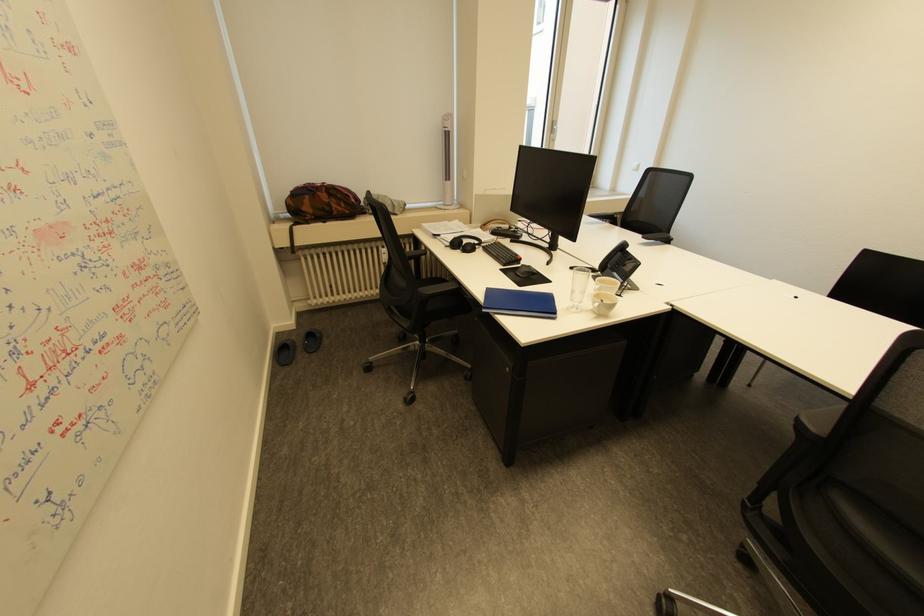
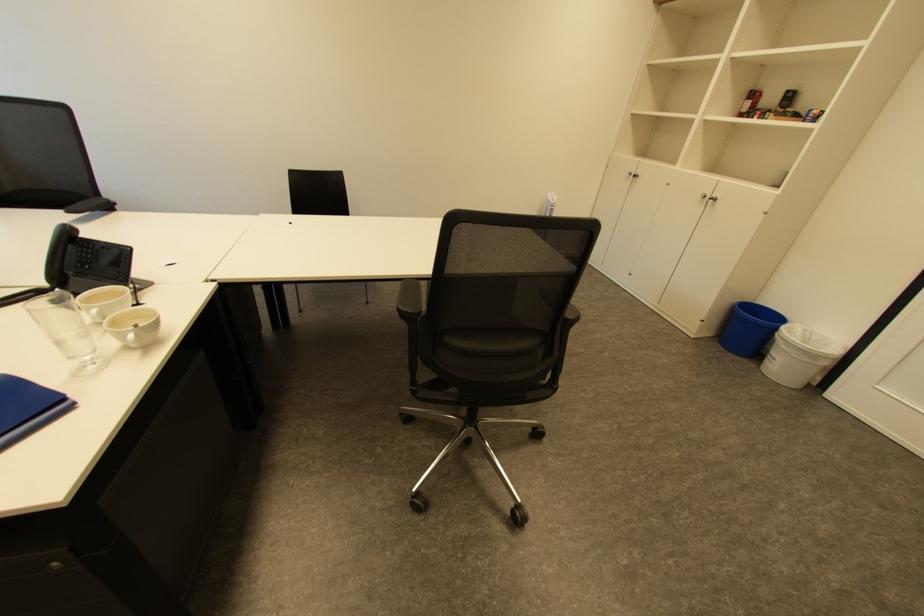
In the second image, find the point that corresponds to point (578, 300) in the first image.

(76, 358)